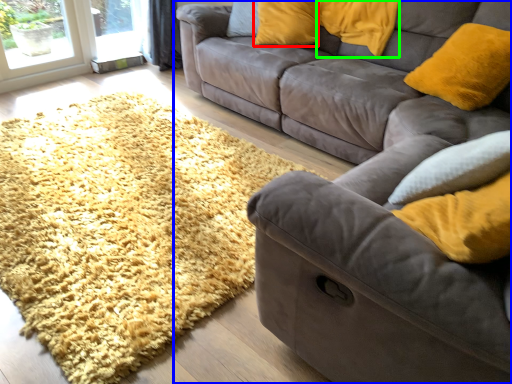
Question: Which is farther away from pillow (highlighted by a red box)? studio couch (highlighted by a blue box) or pillow (highlighted by a green box)?

Choices:
 (A) studio couch
 (B) pillow

Answer: (A)